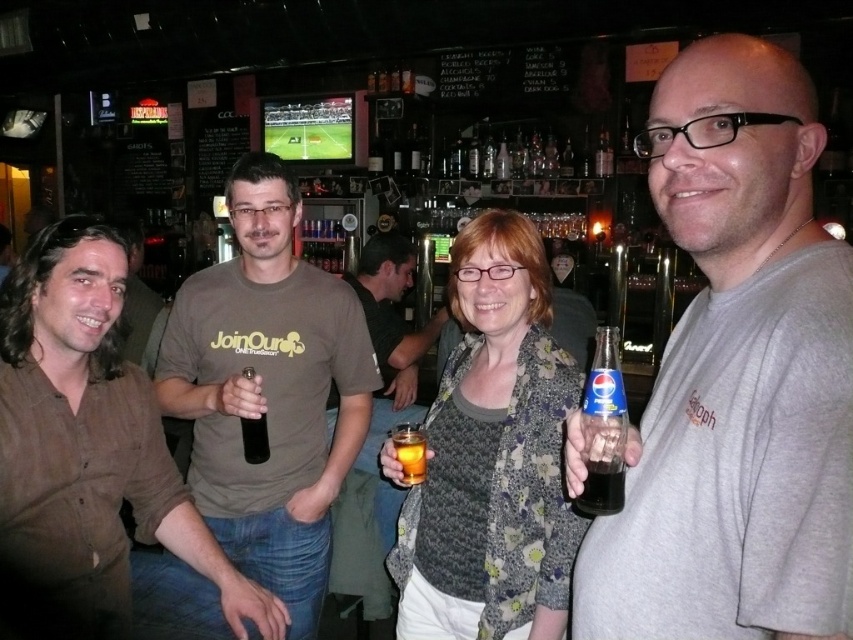
You are standing at the entrance of the bar and see two points marked on the floor. The first point is labeled as point (15, 364) and the second is point (422, 561). Which point is closer to you?

Point (15, 364) is closer to the viewer than point (422, 561).